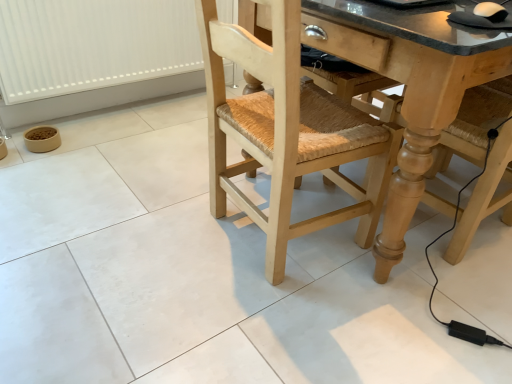
Question: Relative to natural wood chair at center, is granite countertop at center in front or behind?

Choices:
 (A) front
 (B) behind

Answer: (B)

Question: From the image's perspective, is granite countertop at center located above or below natural wood chair at center?

Choices:
 (A) below
 (B) above

Answer: (B)

Question: Which object is the farthest from the granite countertop at center?

Choices:
 (A) white plastic radiator at lower left
 (B) natural wood chair at center

Answer: (A)

Question: Which is nearer to the granite countertop at center?

Choices:
 (A) natural wood chair at center
 (B) white plastic radiator at lower left

Answer: (A)